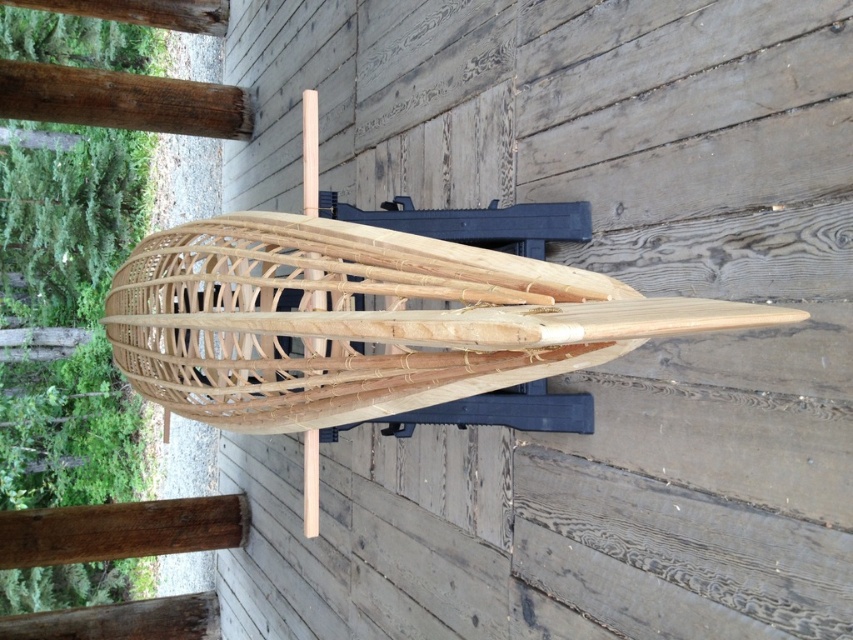
Question: Is natural wood boat at center in front of brown wood beam at upper left?

Choices:
 (A) no
 (B) yes

Answer: (B)

Question: Among these points, which one is farthest from the camera?

Choices:
 (A) (207, 259)
 (B) (165, 86)

Answer: (B)

Question: Which object appears closest to the camera in this image?

Choices:
 (A) natural wood boat at center
 (B) brown wood beam at upper left

Answer: (A)

Question: Can you confirm if natural wood boat at center is positioned to the right of brown wood beam at upper left?

Choices:
 (A) no
 (B) yes

Answer: (B)

Question: Is natural wood boat at center in front of brown wood beam at upper left?

Choices:
 (A) yes
 (B) no

Answer: (A)